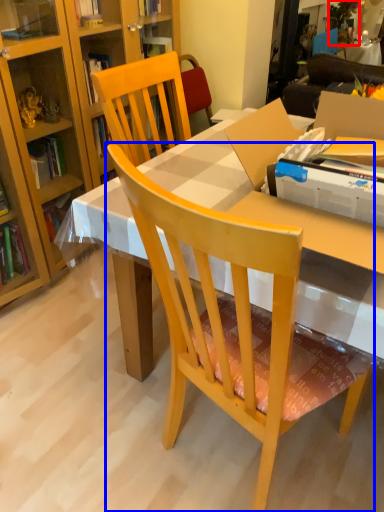
Question: Which object appears farthest to the camera in this image, houseplant (highlighted by a red box) or chair (highlighted by a blue box)?

Choices:
 (A) houseplant
 (B) chair

Answer: (A)